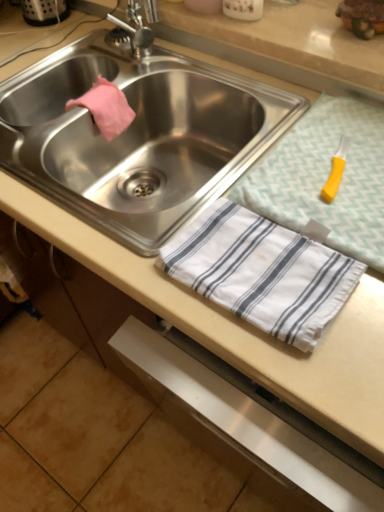
Locate an element on the screen. This screenshot has width=384, height=512. vacant space that is to the left of yellow plastic knife at upper right is located at coordinates (274, 248).